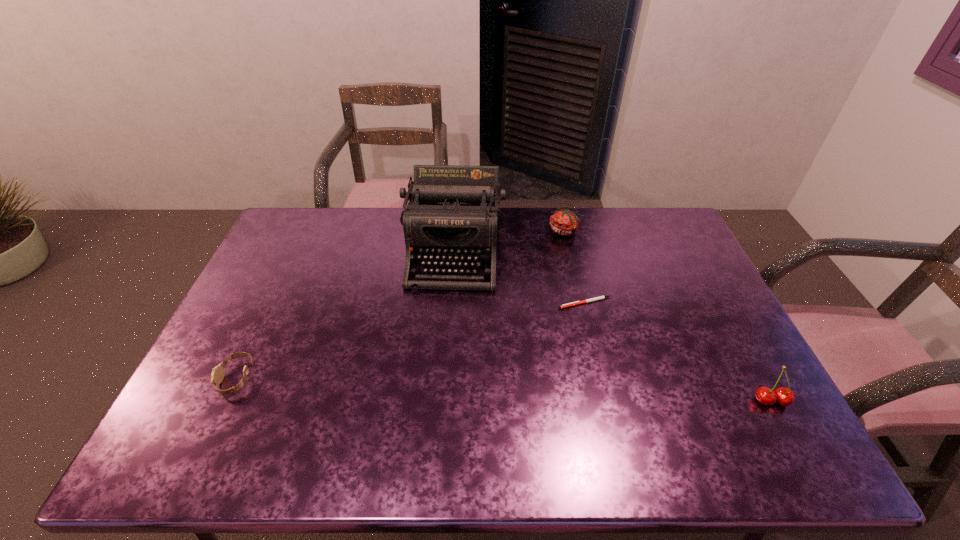
Identify the location of the second shortest object. The image size is (960, 540). pyautogui.click(x=217, y=375).

Locate an element on the screen. This screenshot has height=540, width=960. watch is located at coordinates (217, 375).

This screenshot has width=960, height=540. I want to click on the fourth shortest object, so click(785, 397).

The image size is (960, 540). What are the coordinates of `the rightmost object` in the screenshot? It's located at (785, 397).

The width and height of the screenshot is (960, 540). In order to click on tomato in this screenshot , I will do pyautogui.click(x=563, y=222).

Where is `the third farthest object`? Image resolution: width=960 pixels, height=540 pixels. the third farthest object is located at coordinates (601, 297).

Image resolution: width=960 pixels, height=540 pixels. Identify the location of pen. (601, 297).

Identify the location of the tallest object. (452, 218).

Find the location of a particular element. The image size is (960, 540). typewriter is located at coordinates (452, 218).

In order to click on blank space located on the front-facing side of the tomato in this screenshot , I will do `click(558, 281)`.